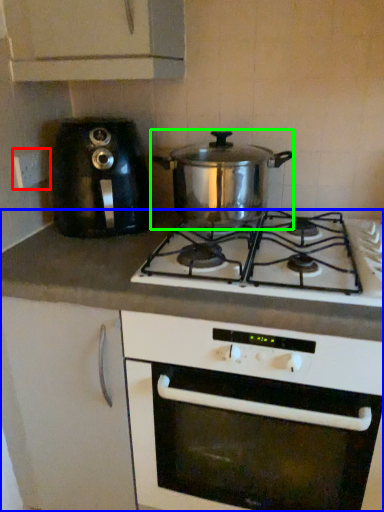
Question: Considering the real-world distances, which object is farthest from electric outlet (highlighted by a red box)? counter (highlighted by a blue box) or kitchen appliance (highlighted by a green box)?

Choices:
 (A) counter
 (B) kitchen appliance

Answer: (A)